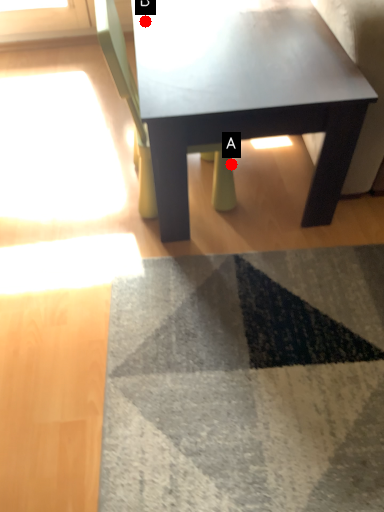
Question: Two points are circled on the image, labeled by A and B beside each circle. Which of the following is the farthest from the observer?

Choices:
 (A) A is further
 (B) B is further

Answer: (A)